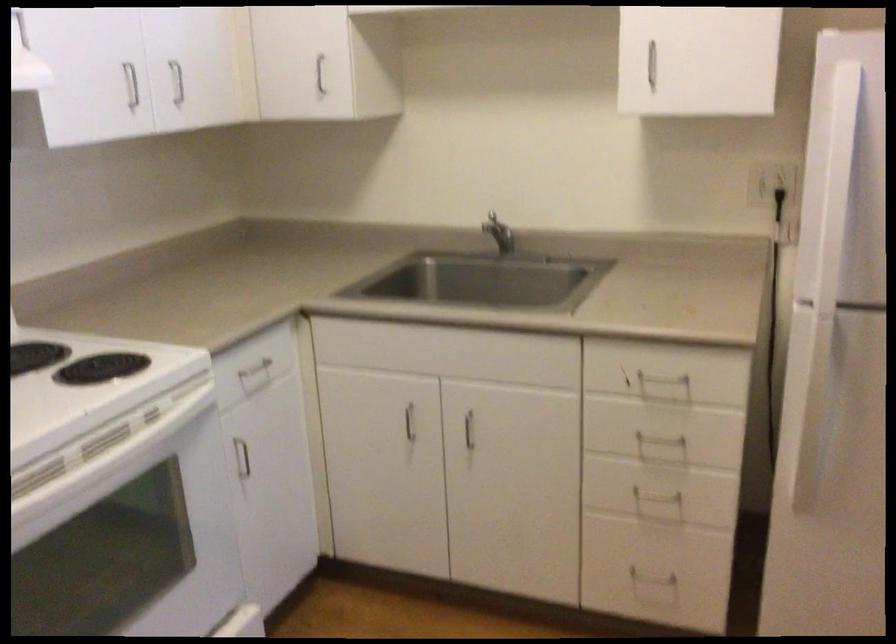
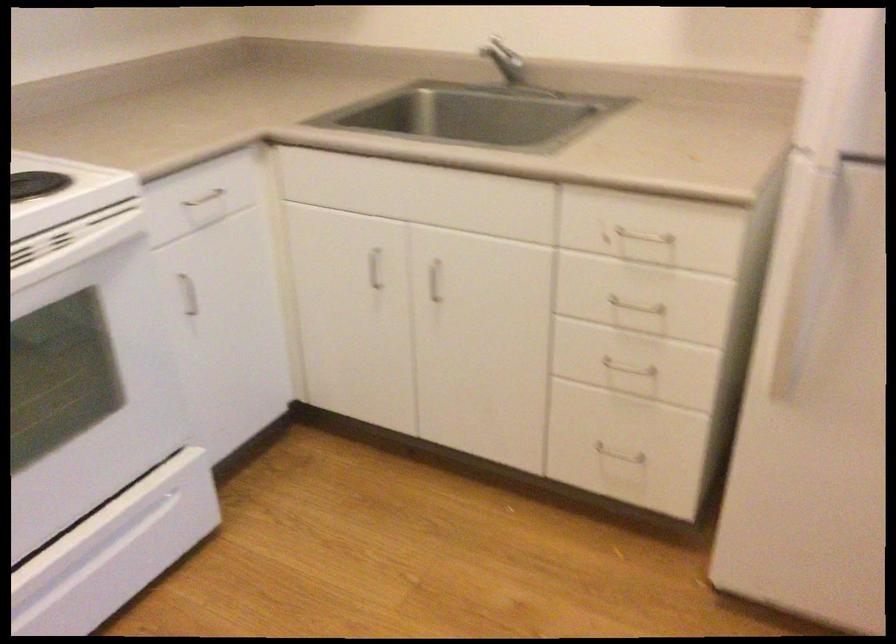
Where in the second image is the point corresponding to (x=653, y=489) from the first image?

(624, 359)